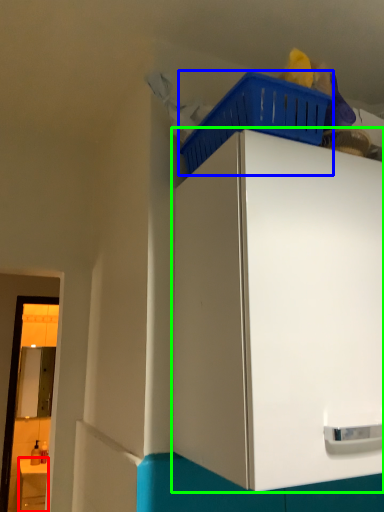
Question: Which is farther away from counter (highlighted by a red box)? basket (highlighted by a blue box) or cabinetry (highlighted by a green box)?

Choices:
 (A) basket
 (B) cabinetry

Answer: (A)